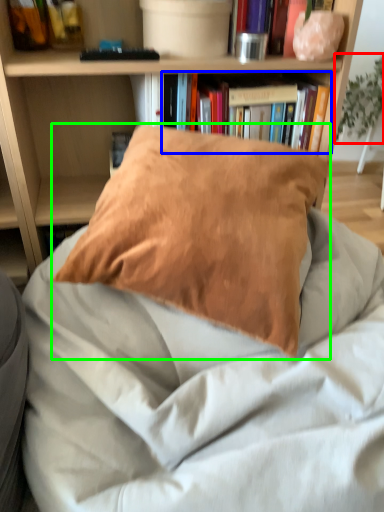
Question: Which object is the closest to the plant (highlighted by a red box)? Choose among these: book (highlighted by a blue box) or pillow (highlighted by a green box).

Choices:
 (A) book
 (B) pillow

Answer: (A)